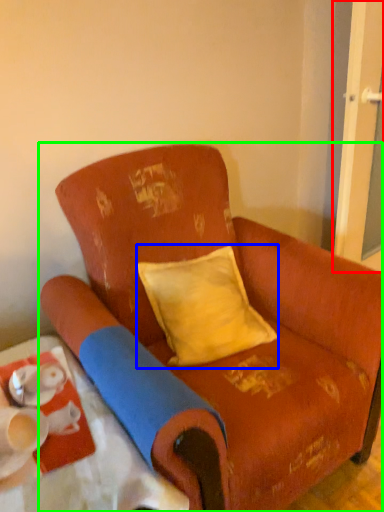
Question: Which object is positioned closest to screen door (highlighted by a red box)? Select from pillow (highlighted by a blue box) and chair (highlighted by a green box).

Choices:
 (A) pillow
 (B) chair

Answer: (A)